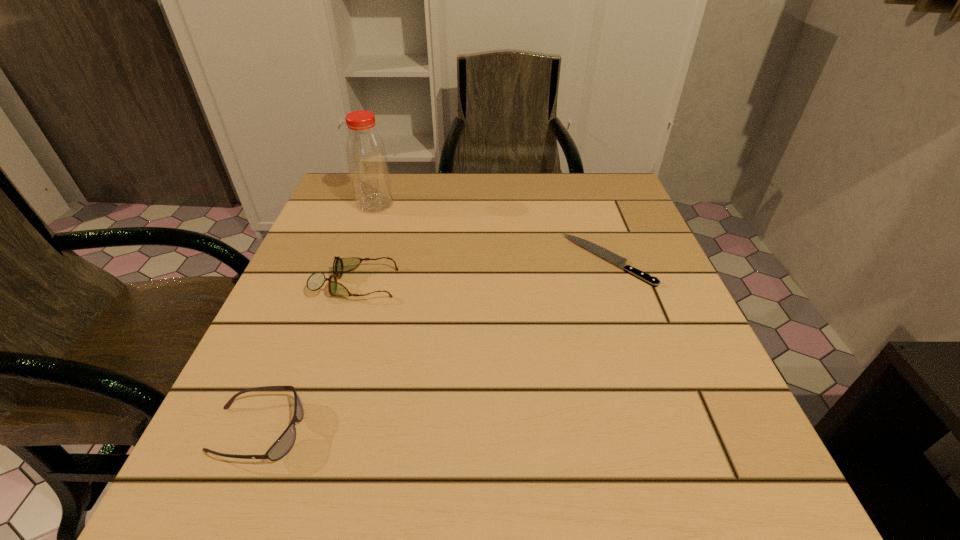
Locate an element on the screen. blank region between the spectacles and the farthest object is located at coordinates (366, 244).

The width and height of the screenshot is (960, 540). In order to click on free spot between the sunglasses and the shortest object in this screenshot , I will do `click(433, 346)`.

Locate an element on the screen. This screenshot has height=540, width=960. free space between the sunglasses and the spectacles is located at coordinates (306, 357).

Find the location of a particular element. free space that is in between the spectacles and the sunglasses is located at coordinates (306, 357).

Identify the location of empty space between the spectacles and the sunglasses. (306, 357).

Where is `vacant region between the bottle and the spectacles`? The height and width of the screenshot is (540, 960). vacant region between the bottle and the spectacles is located at coordinates pyautogui.click(x=366, y=244).

You are a GUI agent. You are given a task and a screenshot of the screen. Output one action in this format:
    pyautogui.click(x=<x>, y=<y>)
    Task: Click on the object that is the closest one to the rightmost object
    The height and width of the screenshot is (540, 960).
    Given the screenshot: What is the action you would take?
    pyautogui.click(x=316, y=280)

You are a GUI agent. You are given a task and a screenshot of the screen. Output one action in this format:
    pyautogui.click(x=<x>, y=<y>)
    Task: Click on the second closest object to the farthest object
    
    Given the screenshot: What is the action you would take?
    pyautogui.click(x=606, y=254)